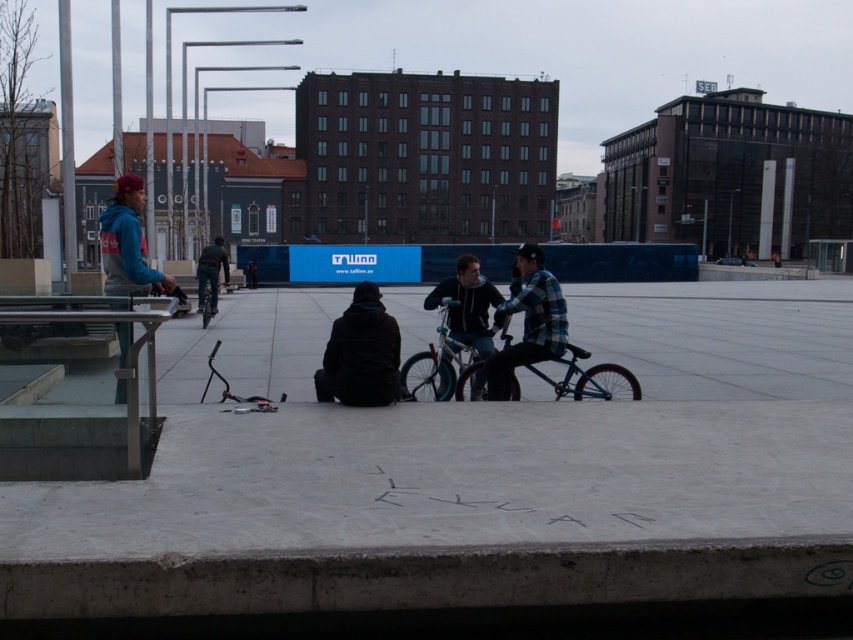
Is blue matte bicycle at center to the right of dark blue jeans at center from the viewer's perspective?

Indeed, blue matte bicycle at center is positioned on the right side of dark blue jeans at center.

Can you confirm if blue matte bicycle at center is positioned below dark blue jeans at center?

Indeed, blue matte bicycle at center is positioned under dark blue jeans at center.

Between point (505, 330) and point (198, 276), which one is positioned in front?

Point (505, 330)

The height and width of the screenshot is (640, 853). Find the location of `blue matte bicycle at center`. blue matte bicycle at center is located at coordinates (440, 365).

Is dark blue jeans at center to the left of blue metallic bicycle at center from the viewer's perspective?

Yes, dark blue jeans at center is to the left of blue metallic bicycle at center.

This screenshot has width=853, height=640. What are the coordinates of `dark blue jeans at center` in the screenshot? It's located at (212, 272).

Is point (213, 264) behind point (212, 285)?

Yes, point (213, 264) is behind point (212, 285).

Find the location of a particular element. This screenshot has height=640, width=853. dark blue jeans at center is located at coordinates (212, 272).

Looking at this image, which is more to the left, plaid flannel shirt at center or blue fleece jacket at left?

blue fleece jacket at left

Is plaid flannel shirt at center bigger than blue fleece jacket at left?

Indeed, plaid flannel shirt at center has a larger size compared to blue fleece jacket at left.

Between point (519, 257) and point (113, 292), which one is positioned in front?

Point (113, 292) is in front.

Where is `plaid flannel shirt at center`? plaid flannel shirt at center is located at coordinates (527, 320).